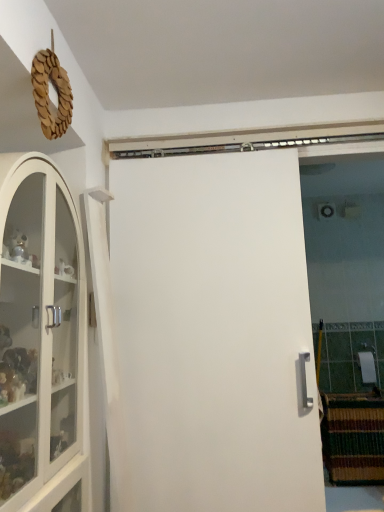
Question: Would you say white matte door at center is outside white glass cabinet at left?

Choices:
 (A) no
 (B) yes

Answer: (B)

Question: Does white matte door at center have a greater width compared to white glass cabinet at left?

Choices:
 (A) yes
 (B) no

Answer: (B)

Question: From the image's perspective, is white matte door at center over white glass cabinet at left?

Choices:
 (A) no
 (B) yes

Answer: (A)

Question: From the image's perspective, is white matte door at center beneath white glass cabinet at left?

Choices:
 (A) no
 (B) yes

Answer: (B)

Question: Is white matte door at center shorter than white glass cabinet at left?

Choices:
 (A) yes
 (B) no

Answer: (B)

Question: Can you see white matte door at center touching white glass cabinet at left?

Choices:
 (A) no
 (B) yes

Answer: (A)

Question: From the image's perspective, would you say white glass cabinet at left is shown under white matte door at center?

Choices:
 (A) no
 (B) yes

Answer: (A)

Question: Is white glass cabinet at left not within white matte door at center?

Choices:
 (A) yes
 (B) no

Answer: (A)

Question: Is white glass cabinet at left taller than white matte door at center?

Choices:
 (A) yes
 (B) no

Answer: (B)

Question: Considering the relative sizes of white glass cabinet at left and white matte door at center in the image provided, is white glass cabinet at left smaller than white matte door at center?

Choices:
 (A) no
 (B) yes

Answer: (A)

Question: From a real-world perspective, is white glass cabinet at left located higher than white matte door at center?

Choices:
 (A) yes
 (B) no

Answer: (A)

Question: Is white glass cabinet at left turned away from white matte door at center?

Choices:
 (A) no
 (B) yes

Answer: (A)

Question: Considering the relative positions of white glass cabinet at left and white matte door at center in the image provided, is white glass cabinet at left to the left or to the right of white matte door at center?

Choices:
 (A) left
 (B) right

Answer: (A)